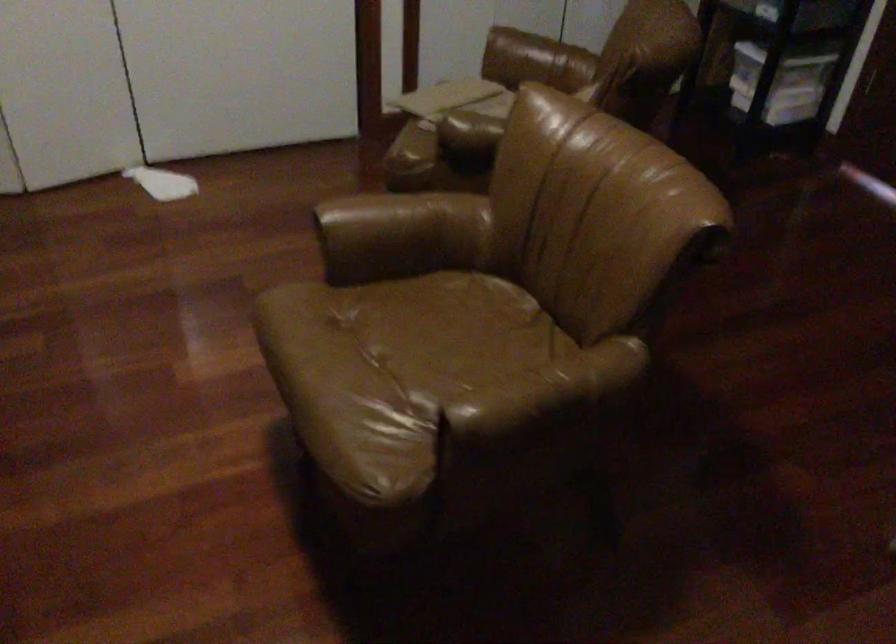
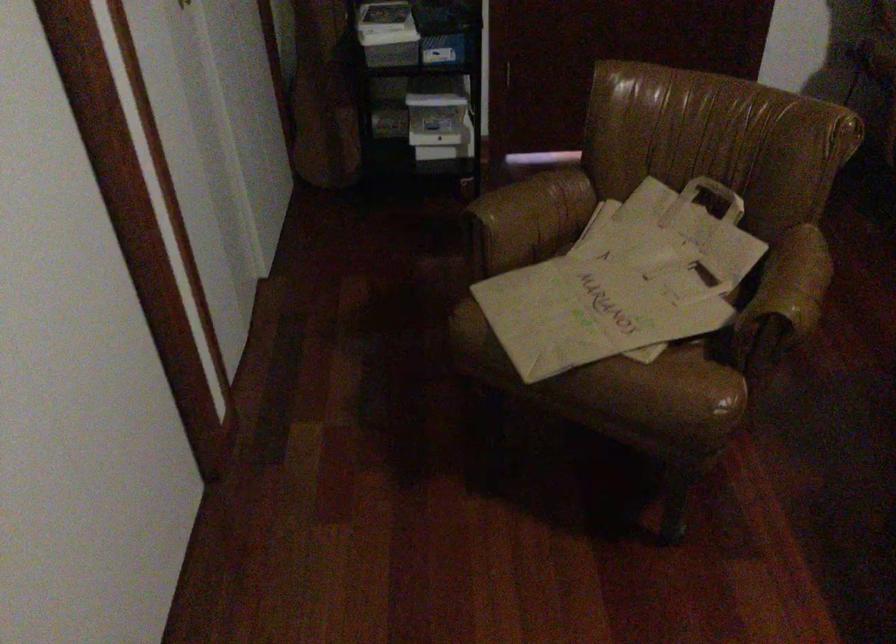
Where in the second image is the point corresponding to (506,126) from the first image?

(803, 275)